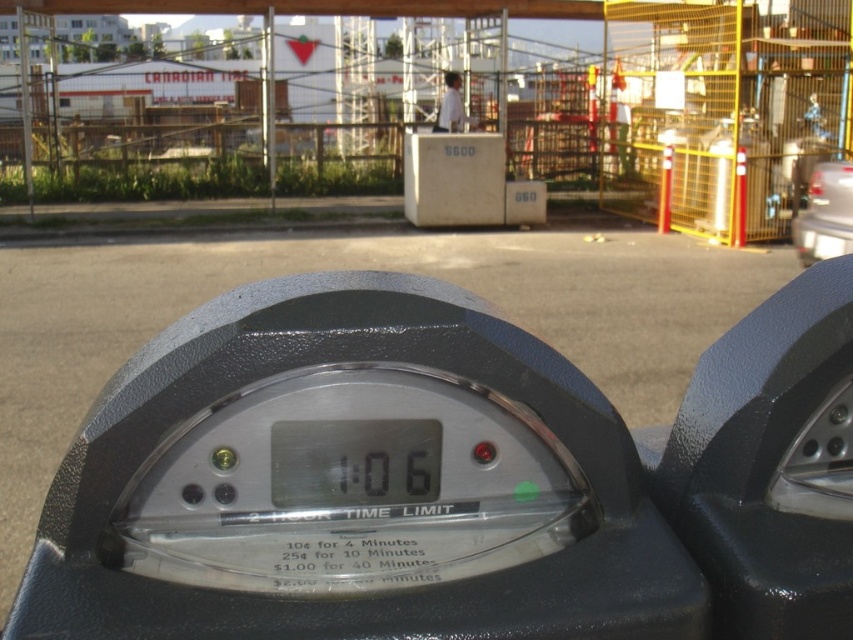
You are a construction worker trying to reach the black matte parking meter at center to check its functionality. You are currently standing behind the metal scaffolding at center. Can you directly access the parking meter without moving the scaffolding?

The metal scaffolding at center is closer to you than the black matte parking meter at center, so you cannot directly access the parking meter without moving the scaffolding.

You are a delivery driver who needs to park near the Canadian Tire store. You see the black matte parking meter at center. Based on its location, can you determine if the meter is positioned near the store entrance?

The black matte parking meter at center is located at point (x=770, y=465), which is near the Canadian Tire store entrance in the background. Therefore, the black matte parking meter at center is positioned near the store entrance.

You are standing in front of a parking meter with a digital display showing 1 hour and 6 minutes remaining. The meter has a label indicating prices for different time increments. There is a point at coordinates (817, 545). Considering your height is 1.7 meters, can you reach this point without any assistance?

The point at (817, 545) is 1.13 meters away from you. Since your height is 1.7 meters, you can comfortably reach this point without needing assistance.